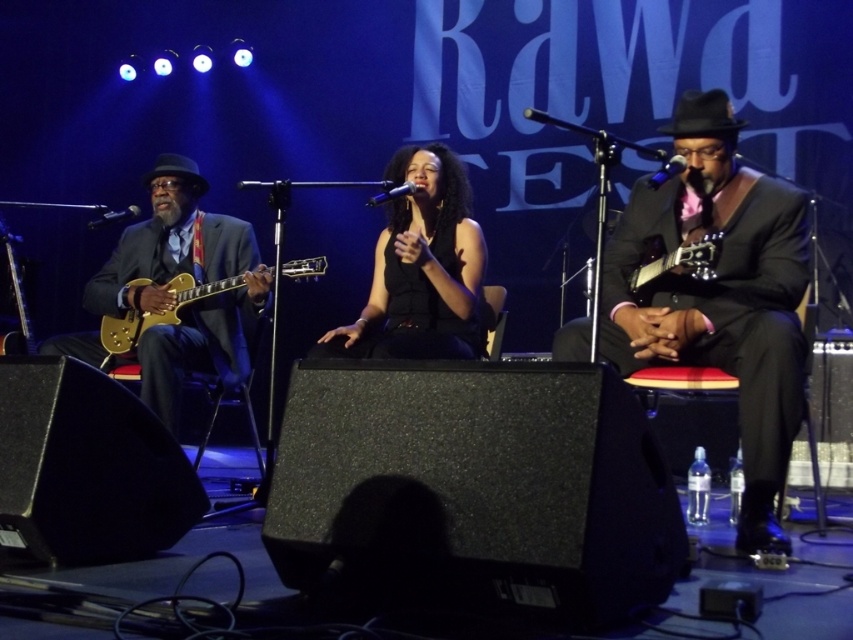
Question: Among these objects, which one is farthest from the camera?

Choices:
 (A) shiny black suit at center
 (B) gold metallic guitar at left

Answer: (B)

Question: Which object appears closest to the camera in this image?

Choices:
 (A) black matte dress at center
 (B) metallic blue microphone at center
 (C) gold metallic guitar at left
 (D) black metallic microphone at center

Answer: (B)

Question: Can you confirm if black matte dress at center is bigger than gold metallic guitar at left?

Choices:
 (A) no
 (B) yes

Answer: (B)

Question: Considering the real-world distances, which object is farthest from the black matte dress at center?

Choices:
 (A) shiny black suit at center
 (B) metallic blue microphone at center
 (C) gold metallic guitar at left

Answer: (B)

Question: Is black matte dress at center below metallic blue microphone at center?

Choices:
 (A) no
 (B) yes

Answer: (B)

Question: Does gold metallic guitar at left have a greater width compared to black matte microphone at left?

Choices:
 (A) no
 (B) yes

Answer: (B)